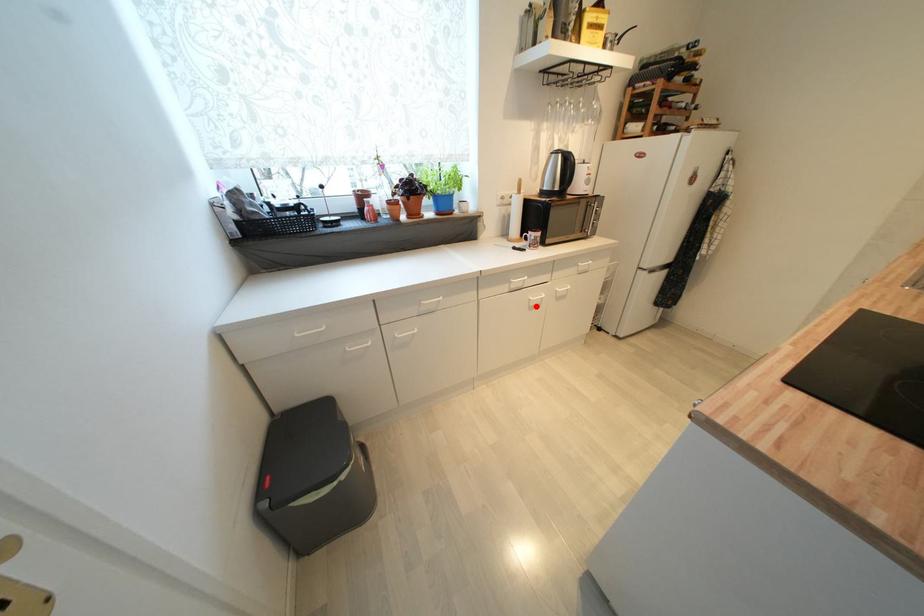
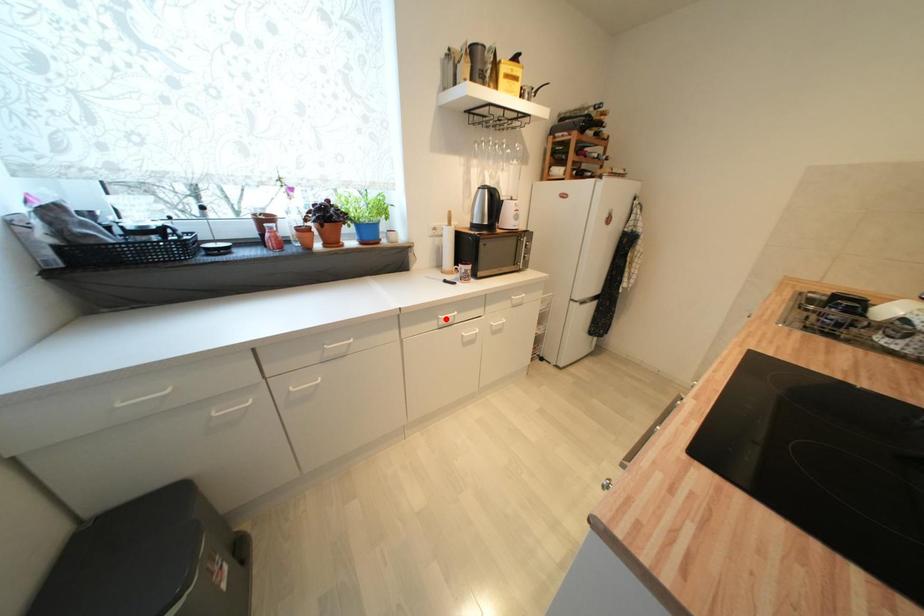
I am providing you with two images of the same scene from different viewpoints. A red point is marked on the first image and another point is marked on the second image. Are the points marked in image1 and image2 representing the same 3D position?

No